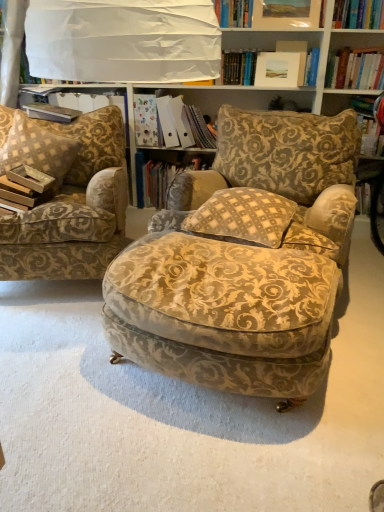
The width and height of the screenshot is (384, 512). What are the coordinates of `matte white picture frame at upper center` in the screenshot? It's located at (280, 69).

The width and height of the screenshot is (384, 512). What do you see at coordinates (51, 112) in the screenshot?
I see `hardcover book at upper left` at bounding box center [51, 112].

Where is `hardcover book at center, which is counted as the 1th book, starting from the bottom`? hardcover book at center, which is counted as the 1th book, starting from the bottom is located at coordinates (162, 176).

Measure the distance between gold-patterned fabric armchair at left, placed as the 1th chair when sorted from left to right, and camera.

gold-patterned fabric armchair at left, placed as the 1th chair when sorted from left to right, is 1.92 meters from camera.

How much space does gold-patterned fabric armchair at left, placed as the 1th chair when sorted from left to right, occupy vertically?

32.91 inches.

The width and height of the screenshot is (384, 512). What do you see at coordinates (36, 147) in the screenshot? I see `beige textured pillow at left, acting as the second pillow starting from the right` at bounding box center [36, 147].

Identify the location of beige textured pillow at left, acting as the second pillow starting from the right. This screenshot has width=384, height=512. (36, 147).

This screenshot has width=384, height=512. What do you see at coordinates (243, 217) in the screenshot?
I see `beige checkered pillow at center, the 2th pillow viewed from the left` at bounding box center [243, 217].

What is the approximate width of beige checkered pillow at center, the first pillow when ordered from right to left?

beige checkered pillow at center, the first pillow when ordered from right to left, is 16.83 inches in width.

Where is `matte white picture frame at upper center`? The width and height of the screenshot is (384, 512). matte white picture frame at upper center is located at coordinates (280, 69).

Is gold-patterned fabric armchair at left, placed as the 1th chair when sorted from left to right, smaller than hardcover book at center, positioned as the 2th book in top-to-bottom order?

Actually, gold-patterned fabric armchair at left, placed as the 1th chair when sorted from left to right, might be larger than hardcover book at center, positioned as the 2th book in top-to-bottom order.

Is hardcover book at center, positioned as the 2th book in top-to-bottom order, at the back of gold-patterned fabric armchair at left, positioned as the 2th chair in right-to-left order?

That's not correct — gold-patterned fabric armchair at left, positioned as the 2th chair in right-to-left order, is not looking away from hardcover book at center, positioned as the 2th book in top-to-bottom order.

Starting from the gold-patterned fabric armchair at left, positioned as the 2th chair in right-to-left order, which book is the 2nd one behind? Please provide its 2D coordinates.

[(162, 176)]

Is gold-patterned fabric armchair at left, positioned as the 2th chair in right-to-left order, not close to hardcover book at center, positioned as the 2th book in top-to-bottom order?

No, there isn't a large distance between gold-patterned fabric armchair at left, positioned as the 2th chair in right-to-left order, and hardcover book at center, positioned as the 2th book in top-to-bottom order.

In the scene shown: Which of these two, velvet gold-patterned ottoman at center, which is counted as the first chair, starting from the right, or hardcover book at upper left, stands taller?

velvet gold-patterned ottoman at center, which is counted as the first chair, starting from the right, is taller.

Is hardcover book at upper left a part of velvet gold-patterned ottoman at center, the 2th chair viewed from the left?

Definitely not — hardcover book at upper left is not inside velvet gold-patterned ottoman at center, the 2th chair viewed from the left.

The height and width of the screenshot is (512, 384). What are the coordinates of `paperback book on the right of the gold-patterned fabric armchair at left, positioned as the 2th chair in right-to-left order` in the screenshot? It's located at (51, 112).

From a real-world perspective, is gold-patterned fabric armchair at left, placed as the 1th chair when sorted from left to right, located higher than hardcover book at upper left?

Incorrect, from a real-world perspective, gold-patterned fabric armchair at left, placed as the 1th chair when sorted from left to right, is lower than hardcover book at upper left.

From their relative heights in the image, would you say gold-patterned fabric armchair at left, positioned as the 2th chair in right-to-left order, is taller or shorter than hardcover book at upper left?

In the image, gold-patterned fabric armchair at left, positioned as the 2th chair in right-to-left order, appears to be taller than hardcover book at upper left.

Is velvet gold-patterned ottoman at center, the 2th chair viewed from the left, not near gold-patterned fabric armchair at left, placed as the 1th chair when sorted from left to right?

No.

Which object is positioned more to the right, velvet gold-patterned ottoman at center, the 2th chair viewed from the left, or gold-patterned fabric armchair at left, placed as the 1th chair when sorted from left to right?

Positioned to the right is velvet gold-patterned ottoman at center, the 2th chair viewed from the left.

From the image's perspective, is velvet gold-patterned ottoman at center, the 2th chair viewed from the left, on top of gold-patterned fabric armchair at left, positioned as the 2th chair in right-to-left order?

No, from the image's perspective, velvet gold-patterned ottoman at center, the 2th chair viewed from the left, is not over gold-patterned fabric armchair at left, positioned as the 2th chair in right-to-left order.

Is velvet gold-patterned ottoman at center, the 2th chair viewed from the left, turned away from gold-patterned fabric armchair at left, positioned as the 2th chair in right-to-left order?

No, gold-patterned fabric armchair at left, positioned as the 2th chair in right-to-left order, is not at the back of velvet gold-patterned ottoman at center, the 2th chair viewed from the left.

Could gold-patterned fabric armchair at left, positioned as the 2th chair in right-to-left order, be considered to be inside matte white picture frame at upper center?

No, gold-patterned fabric armchair at left, positioned as the 2th chair in right-to-left order, is not inside matte white picture frame at upper center.

Considering the sizes of objects matte white picture frame at upper center and gold-patterned fabric armchair at left, positioned as the 2th chair in right-to-left order, in the image provided, who is smaller, matte white picture frame at upper center or gold-patterned fabric armchair at left, positioned as the 2th chair in right-to-left order,?

matte white picture frame at upper center.

From the image's perspective, which is above, matte white picture frame at upper center or gold-patterned fabric armchair at left, positioned as the 2th chair in right-to-left order?

matte white picture frame at upper center, from the image's perspective.

Would you say matte white picture frame at upper center is to the left or to the right of gold-patterned fabric armchair at left, placed as the 1th chair when sorted from left to right, in the picture?

In the image, matte white picture frame at upper center appears on the right side of gold-patterned fabric armchair at left, placed as the 1th chair when sorted from left to right.

Is beige checkered pillow at center, the 1th pillow when ordered from front to back, situated inside velvet gold-patterned ottoman at center, which is counted as the first chair, starting from the right, or outside?

beige checkered pillow at center, the 1th pillow when ordered from front to back, is not enclosed by velvet gold-patterned ottoman at center, which is counted as the first chair, starting from the right.

Considering the relative sizes of beige checkered pillow at center, the first pillow when ordered from right to left, and velvet gold-patterned ottoman at center, which is counted as the first chair, starting from the right, in the image provided, is beige checkered pillow at center, the first pillow when ordered from right to left, wider than velvet gold-patterned ottoman at center, which is counted as the first chair, starting from the right,?

Incorrect, the width of beige checkered pillow at center, the first pillow when ordered from right to left, does not surpass that of velvet gold-patterned ottoman at center, which is counted as the first chair, starting from the right.

Consider the image. How much distance is there between beige checkered pillow at center, the second pillow in the back-to-front sequence, and velvet gold-patterned ottoman at center, the 2th chair viewed from the left?

beige checkered pillow at center, the second pillow in the back-to-front sequence, is 7.54 inches from velvet gold-patterned ottoman at center, the 2th chair viewed from the left.

Is point (257, 237) positioned before point (274, 231)?

Yes.

At what (x,y) coordinates should I click in order to perform the action: click on book above the hardcover book at upper left (from the image's perspective). Please return your answer as a coordinate pair (x, y). The height and width of the screenshot is (512, 384). Looking at the image, I should click on (183, 124).

From a real-world perspective, is matte paper folder at center, positioned as the second book in bottom-to-top order, physically located above or below hardcover book at upper left?

Clearly, from a real-world perspective, matte paper folder at center, positioned as the second book in bottom-to-top order, is below hardcover book at upper left.

Does matte paper folder at center, acting as the 1th book starting from the top, lie in front of hardcover book at upper left?

No, the depth of matte paper folder at center, acting as the 1th book starting from the top, is greater than that of hardcover book at upper left.

Does point (179, 128) come farther from viewer compared to point (63, 106)?

Yes, point (179, 128) is farther from viewer.

I want to click on chair above the hardcover book at center, which is counted as the 1th book, starting from the bottom (from a real-world perspective), so click(x=66, y=197).

Find the location of `chair that is the 2nd object located below the hardcover book at upper left (from the image's perspective)`. chair that is the 2nd object located below the hardcover book at upper left (from the image's perspective) is located at coordinates (242, 267).

Based on the photo, from the image, which object appears to be farther from hardcover book at upper left, beige checkered pillow at center, the first pillow when ordered from right to left, or matte paper folder at center, positioned as the second book in bottom-to-top order?

The object further to hardcover book at upper left is beige checkered pillow at center, the first pillow when ordered from right to left.

Estimate the real-world distances between objects in this image. Which object is further from hardcover book at center, which is counted as the 1th book, starting from the bottom, matte white picture frame at upper center or velvet gold-patterned ottoman at center, the 2th chair viewed from the left?

velvet gold-patterned ottoman at center, the 2th chair viewed from the left, lies further to hardcover book at center, which is counted as the 1th book, starting from the bottom, than the other object.

Based on their spatial positions, is matte white picture frame at upper center or gold-patterned fabric armchair at left, positioned as the 2th chair in right-to-left order, further from velvet gold-patterned ottoman at center, which is counted as the first chair, starting from the right?

matte white picture frame at upper center is positioned further to the anchor velvet gold-patterned ottoman at center, which is counted as the first chair, starting from the right.

Looking at this image, considering their positions, is matte white picture frame at upper center positioned closer to gold-patterned fabric armchair at left, positioned as the 2th chair in right-to-left order, than beige checkered pillow at center, the second pillow in the back-to-front sequence?

beige checkered pillow at center, the second pillow in the back-to-front sequence, lies closer to gold-patterned fabric armchair at left, positioned as the 2th chair in right-to-left order, than the other object.

Based on their spatial positions, is beige checkered pillow at center, the 1th pillow when ordered from front to back, or matte paper folder at center, positioned as the second book in bottom-to-top order, further from beige textured pillow at left, the first pillow when ordered from left to right?

beige checkered pillow at center, the 1th pillow when ordered from front to back, is positioned further to the anchor beige textured pillow at left, the first pillow when ordered from left to right.

Which object lies further to the anchor point beige textured pillow at left, acting as the second pillow starting from the right, hardcover book at center, which is counted as the 1th book, starting from the bottom, or velvet gold-patterned ottoman at center, the 2th chair viewed from the left?

velvet gold-patterned ottoman at center, the 2th chair viewed from the left.

Which object lies further to the anchor point hardcover book at center, positioned as the 2th book in top-to-bottom order, velvet gold-patterned ottoman at center, which is counted as the first chair, starting from the right, or matte white picture frame at upper center?

Among the two, velvet gold-patterned ottoman at center, which is counted as the first chair, starting from the right, is located further to hardcover book at center, positioned as the 2th book in top-to-bottom order.

Which object lies further to the anchor point hardcover book at center, positioned as the 2th book in top-to-bottom order, matte white picture frame at upper center or hardcover book at upper left?

Among the two, matte white picture frame at upper center is located further to hardcover book at center, positioned as the 2th book in top-to-bottom order.

At what (x,y) coordinates should I click in order to perform the action: click on paperback book located between gold-patterned fabric armchair at left, placed as the 1th chair when sorted from left to right, and matte white picture frame at upper center in the left-right direction. Please return your answer as a coordinate pair (x, y). Looking at the image, I should click on (51, 112).

This screenshot has width=384, height=512. Find the location of `paperback book positioned between velvet gold-patterned ottoman at center, the 2th chair viewed from the left, and hardcover book at center, which is counted as the 1th book, starting from the bottom, from near to far`. paperback book positioned between velvet gold-patterned ottoman at center, the 2th chair viewed from the left, and hardcover book at center, which is counted as the 1th book, starting from the bottom, from near to far is located at coordinates (51, 112).

The image size is (384, 512). In order to click on paperback book between gold-patterned fabric armchair at left, positioned as the 2th chair in right-to-left order, and hardcover book at center, positioned as the 2th book in top-to-bottom order, from front to back in this screenshot , I will do `click(51, 112)`.

What are the coordinates of `paperback book between beige textured pillow at left, the 1th pillow positioned from the back, and matte white picture frame at upper center from left to right` in the screenshot? It's located at (51, 112).